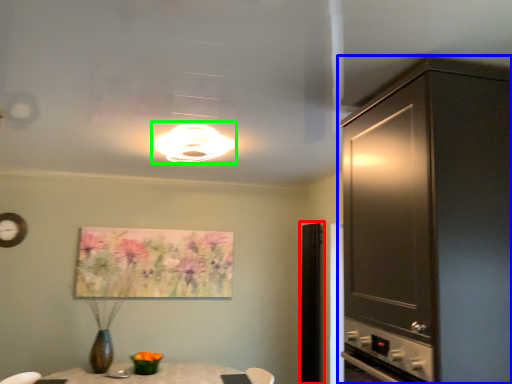
Question: Which object is positioned farthest from glass door (highlighted by a red box)? Select from cabinetry (highlighted by a blue box) and light fixture (highlighted by a green box).

Choices:
 (A) cabinetry
 (B) light fixture

Answer: (A)